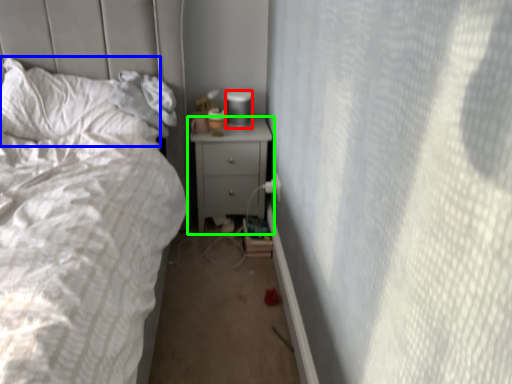
Question: Based on their relative distances, which object is farther from gray (highlighted by a red box)? Choose from pillow (highlighted by a blue box) and nightstand (highlighted by a green box).

Choices:
 (A) pillow
 (B) nightstand

Answer: (A)